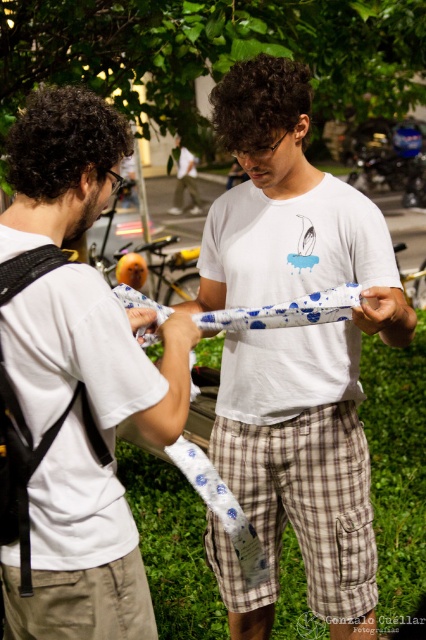
Question: Which point is farther from the camera taking this photo?

Choices:
 (A) (350, 518)
 (B) (112, 385)

Answer: (A)

Question: Can you confirm if white cotton t-shirt at center is thinner than white matte t-shirt at center?

Choices:
 (A) no
 (B) yes

Answer: (A)

Question: Which point is farther to the camera?

Choices:
 (A) white cotton t-shirt at center
 (B) white matte t-shirt at center

Answer: (A)

Question: Can you confirm if white cotton t-shirt at center is thinner than white matte t-shirt at center?

Choices:
 (A) no
 (B) yes

Answer: (A)

Question: Which of the following is the closest to the observer?

Choices:
 (A) (114, 632)
 (B) (350, 356)

Answer: (A)

Question: Can you confirm if white cotton t-shirt at center is positioned below white matte t-shirt at center?

Choices:
 (A) yes
 (B) no

Answer: (A)